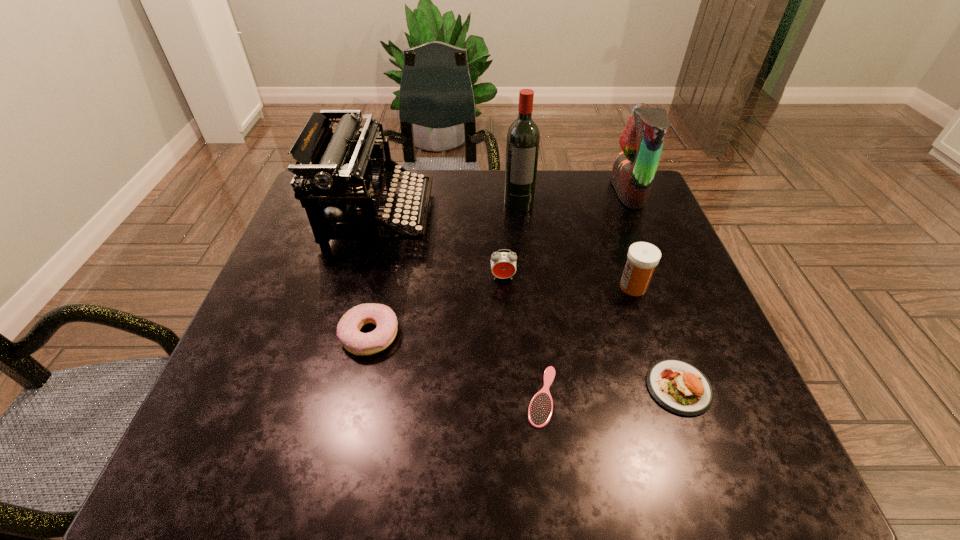
This screenshot has height=540, width=960. In order to click on wine bottle in this screenshot , I will do `click(523, 138)`.

The width and height of the screenshot is (960, 540). Identify the location of parrot. pos(642,140).

Where is `typewriter`? This screenshot has height=540, width=960. typewriter is located at coordinates (347, 171).

The height and width of the screenshot is (540, 960). I want to click on medicine, so click(x=642, y=258).

At what (x,y) coordinates should I click in order to perform the action: click on the fifth tallest object. Please return your answer as a coordinate pair (x, y). The image size is (960, 540). Looking at the image, I should click on (503, 264).

In order to click on the third nearest object in this screenshot , I will do `click(348, 329)`.

You are a GUI agent. You are given a task and a screenshot of the screen. Output one action in this format:
    pyautogui.click(x=<x>, y=<y>)
    Task: Click on the seventh tallest object
    
    Given the screenshot: What is the action you would take?
    (x=679, y=387)

The height and width of the screenshot is (540, 960). Identify the location of the shortest object. (540, 409).

Locate an element on the screen. This screenshot has height=540, width=960. vacant space situated on the label of the tallest object is located at coordinates (531, 321).

I want to click on vacant space located at the face of the parrot, so click(596, 192).